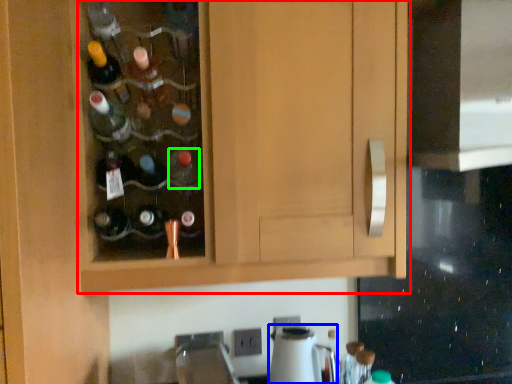
Question: Which is farther away from cabinetry (highlighted by a red box)? appliance (highlighted by a blue box) or bottle (highlighted by a green box)?

Choices:
 (A) appliance
 (B) bottle

Answer: (A)